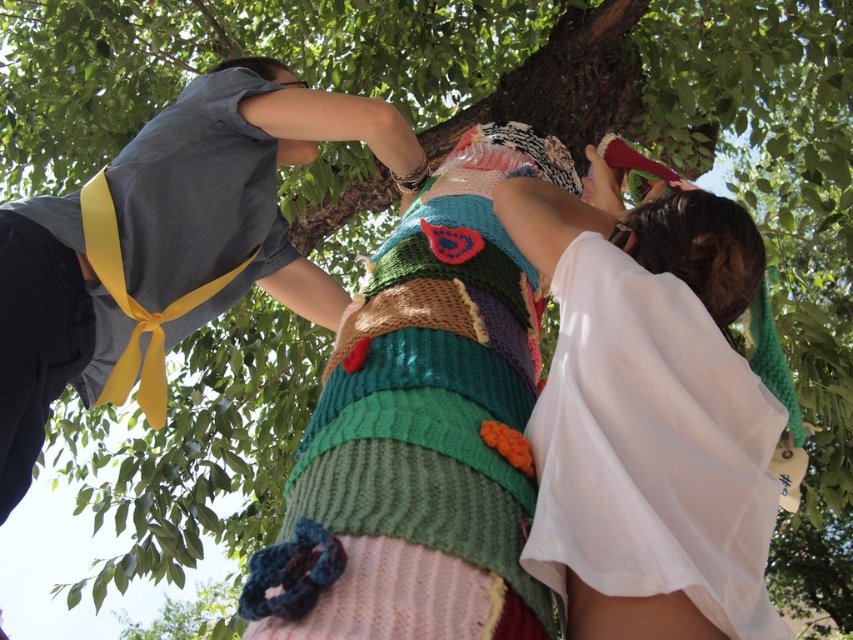
Question: Is the position of knitted fabric at center less distant than that of white sheer fabric dress at lower right?

Choices:
 (A) yes
 (B) no

Answer: (A)

Question: Which point is farther from the camera taking this photo?

Choices:
 (A) (747, 513)
 (B) (308, 509)

Answer: (A)

Question: Can you confirm if knitted fabric at center is positioned below white sheer fabric dress at lower right?

Choices:
 (A) no
 (B) yes

Answer: (A)

Question: Does knitted fabric at center have a greater width compared to white sheer fabric dress at lower right?

Choices:
 (A) no
 (B) yes

Answer: (B)

Question: Which of the following is the closest to the observer?

Choices:
 (A) white sheer fabric dress at lower right
 (B) knitted fabric at center

Answer: (B)

Question: Which object appears closest to the camera in this image?

Choices:
 (A) white sheer fabric dress at lower right
 (B) knitted fabric at center

Answer: (B)